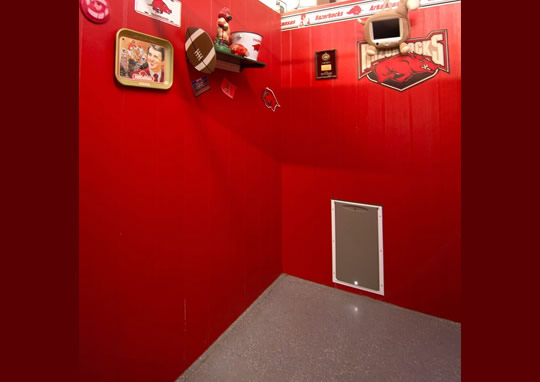
This screenshot has width=540, height=382. I want to click on award, so click(327, 57).